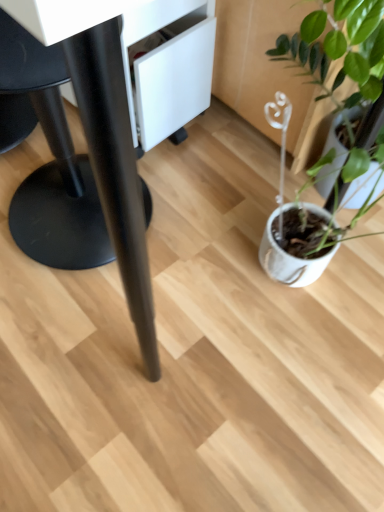
Identify the location of black matte table at center. (104, 139).

The image size is (384, 512). I want to click on black matte swivel chair at left, so click(51, 164).

Find the location of a particular element. The width and height of the screenshot is (384, 512). black matte table at center is located at coordinates (104, 139).

Does black matte table at center touch white matte pot at right?

No, black matte table at center is not touching white matte pot at right.

How far apart are black matte table at center and white matte pot at right?

black matte table at center is 16.62 inches from white matte pot at right.

Is black matte table at center located outside white matte pot at right?

That's correct, black matte table at center is outside of white matte pot at right.

Considering the relative sizes of black matte table at center and white matte pot at right in the image provided, is black matte table at center smaller than white matte pot at right?

Incorrect, black matte table at center is not smaller in size than white matte pot at right.

Is white matte pot at right inside the boundaries of black matte swivel chair at left, or outside?

white matte pot at right is not inside black matte swivel chair at left, it's outside.

Does white matte pot at right have a lesser width compared to black matte swivel chair at left?

Yes.

Does white matte pot at right have a larger size compared to black matte swivel chair at left?

No.

Between black matte swivel chair at left and white matte pot at right, which one has less height?

Standing shorter between the two is white matte pot at right.

Is black matte swivel chair at left next to white matte pot at right?

No, black matte swivel chair at left is not next to white matte pot at right.

Which of these two, black matte swivel chair at left or white matte pot at right, is thinner?

white matte pot at right.

Who is smaller, black matte swivel chair at left or white matte pot at right?

white matte pot at right.

Locate an element on the screen. The height and width of the screenshot is (512, 384). table above the white matte pot at right (from a real-world perspective) is located at coordinates (104, 139).

Could you tell me if white matte pot at right is turned towards black matte table at center?

No, white matte pot at right is not facing towards black matte table at center.

Is white matte pot at right directly adjacent to black matte table at center?

They are not placed beside each other.

From a real-world perspective, which object rests below the other?

From a 3D spatial view, black matte swivel chair at left is below.

The width and height of the screenshot is (384, 512). I want to click on swivel chair below the black matte table at center (from a real-world perspective), so click(51, 164).

Is black matte table at center at the right side of black matte swivel chair at left?

Yes.

Which of these two, black matte swivel chair at left or black matte table at center, is wider?

With larger width is black matte table at center.

Considering the positions of point (72, 210) and point (89, 106), is point (72, 210) closer or farther from the camera than point (89, 106)?

Point (72, 210) is farther from the camera than point (89, 106).

Is black matte table at center surrounded by black matte swivel chair at left?

No.

From a real-world perspective, is black matte swivel chair at left above or below black matte table at center?

From a real-world perspective, black matte swivel chair at left is physically below black matte table at center.

I want to click on table located above the white matte pot at right (from a real-world perspective), so click(104, 139).

Where is `houseplant lying on the right of black matte swivel chair at left`? The height and width of the screenshot is (512, 384). houseplant lying on the right of black matte swivel chair at left is located at coordinates (344, 75).

Which object lies nearer to the anchor point black matte swivel chair at left, white matte pot at right or black matte table at center?

Based on the image, black matte table at center appears to be nearer to black matte swivel chair at left.

Based on their spatial positions, is white matte pot at right or black matte swivel chair at left closer to black matte table at center?

black matte swivel chair at left lies closer to black matte table at center than the other object.

From the picture: Which object lies further to the anchor point black matte swivel chair at left, black matte table at center or white matte pot at right?

white matte pot at right is further to black matte swivel chair at left.

Considering their positions, is black matte swivel chair at left positioned further to black matte table at center than white matte pot at right?

The object further to black matte table at center is white matte pot at right.

When comparing their distances from white matte pot at right, does black matte swivel chair at left or black matte table at center seem closer?

Among the two, black matte table at center is located nearer to white matte pot at right.

Considering their positions, is black matte table at center positioned closer to white matte pot at right than black matte swivel chair at left?

Based on the image, black matte table at center appears to be nearer to white matte pot at right.

Where is `table between black matte swivel chair at left and white matte pot at right in the horizontal direction`? This screenshot has height=512, width=384. table between black matte swivel chair at left and white matte pot at right in the horizontal direction is located at coordinates (104, 139).